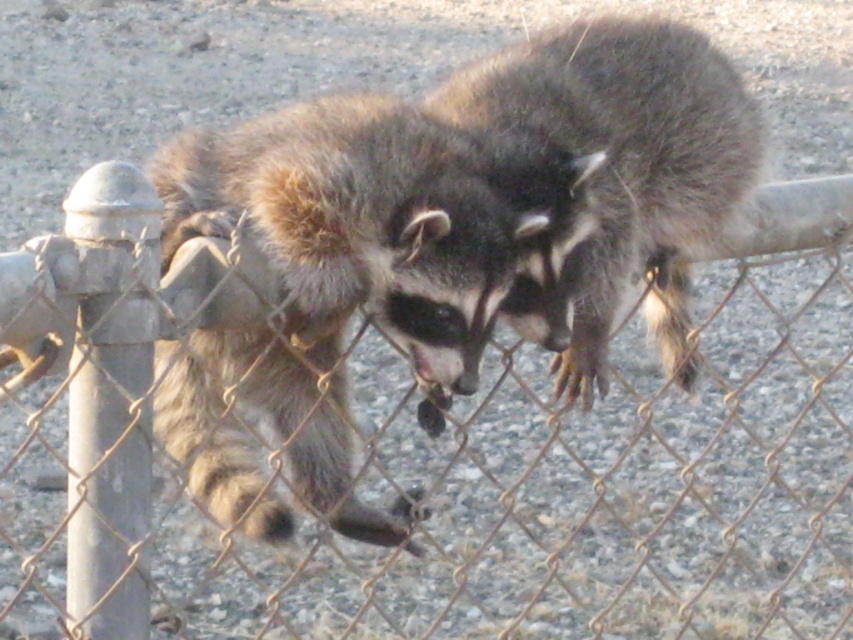
You are a wildlife photographer trying to capture a photo of both the fuzzy brown raccoon at center and the dark brown fur raccoon at center. Your camera has a minimum focus distance of 6 inches. Can you focus on both raccoons at the same time?

The distance between the fuzzy brown raccoon at center and the dark brown fur raccoon at center is 5.87 inches, which is less than the camera minimum focus distance of 6 inches. Therefore, you can focus on both raccoons at the same time.

You are standing in front of the fence where the two raccoons are. You notice two points marked on the fence. The first point is at coordinates point (193, 157) and the second point is at point (544, 132). Which point is closer to you?

Point (193, 157) is closer to the viewer than point (544, 132).